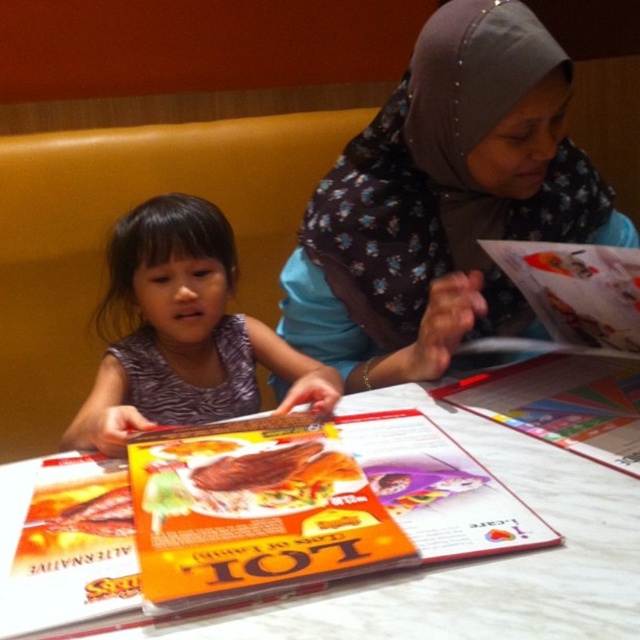
How much distance is there between floral-patterned hijab at upper right and orange glossy menu at center?

The distance of floral-patterned hijab at upper right from orange glossy menu at center is 6.14 inches.

Does floral-patterned hijab at upper right appear on the right side of orange glossy menu at center?

No, floral-patterned hijab at upper right is not to the right of orange glossy menu at center.

Between point (417, 188) and point (474, 346), which one is positioned behind?

The point (474, 346) is behind.

Where is `floral-patterned hijab at upper right`? The height and width of the screenshot is (640, 640). floral-patterned hijab at upper right is located at coordinates (444, 202).

Between purple fabric dress at center and orange glossy menu at center, which one has more height?

Standing taller between the two is purple fabric dress at center.

Does purple fabric dress at center appear on the left side of orange glossy menu at center?

Correct, you'll find purple fabric dress at center to the left of orange glossy menu at center.

Is point (161, 250) positioned before point (529, 259)?

No.

The height and width of the screenshot is (640, 640). I want to click on purple fabric dress at center, so click(x=182, y=332).

Looking at this image, which of these two, floral-patterned hijab at upper right or white glossy table at center, stands taller?

Standing taller between the two is floral-patterned hijab at upper right.

Can you confirm if floral-patterned hijab at upper right is positioned to the right of white glossy table at center?

Correct, you'll find floral-patterned hijab at upper right to the right of white glossy table at center.

You are a GUI agent. You are given a task and a screenshot of the screen. Output one action in this format:
    pyautogui.click(x=<x>, y=<y>)
    Task: Click on the floral-patterned hijab at upper right
    
    Given the screenshot: What is the action you would take?
    pyautogui.click(x=444, y=202)

Identify the location of floral-patterned hijab at upper right. The height and width of the screenshot is (640, 640). (444, 202).